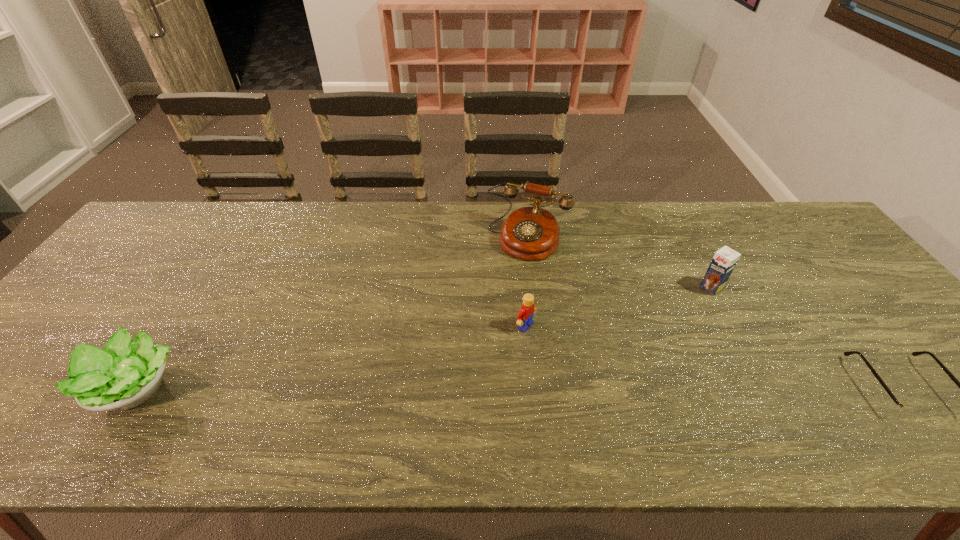
This screenshot has height=540, width=960. I want to click on vacant region at the left edge, so click(x=142, y=297).

In the image, there is a desktop. Identify the location of free space at the right edge. The width and height of the screenshot is (960, 540). (818, 253).

Find the location of a particular element. The height and width of the screenshot is (540, 960). free space at the far left corner is located at coordinates (174, 242).

The height and width of the screenshot is (540, 960). In order to click on vacant space at the far right corner of the desktop in this screenshot , I will do `click(793, 242)`.

Identify the location of free space at the near right corner. (959, 396).

You are a GUI agent. You are given a task and a screenshot of the screen. Output one action in this format:
    pyautogui.click(x=<x>, y=<y>)
    Task: Click on the vacant space in between the lettuce and the tallest object
    Image resolution: width=960 pixels, height=540 pixels.
    Given the screenshot: What is the action you would take?
    pyautogui.click(x=331, y=313)

Where is `free spot between the Lego and the lettuce`? The image size is (960, 540). free spot between the Lego and the lettuce is located at coordinates (329, 356).

This screenshot has width=960, height=540. What are the coordinates of `blank region between the Lego and the second object from right to left` in the screenshot? It's located at (618, 307).

Identify the location of unoccupied area between the lettuce and the farthest object. The height and width of the screenshot is (540, 960). (331, 313).

Image resolution: width=960 pixels, height=540 pixels. I want to click on empty location between the leftmost object and the fourth object from left to right, so click(x=422, y=338).